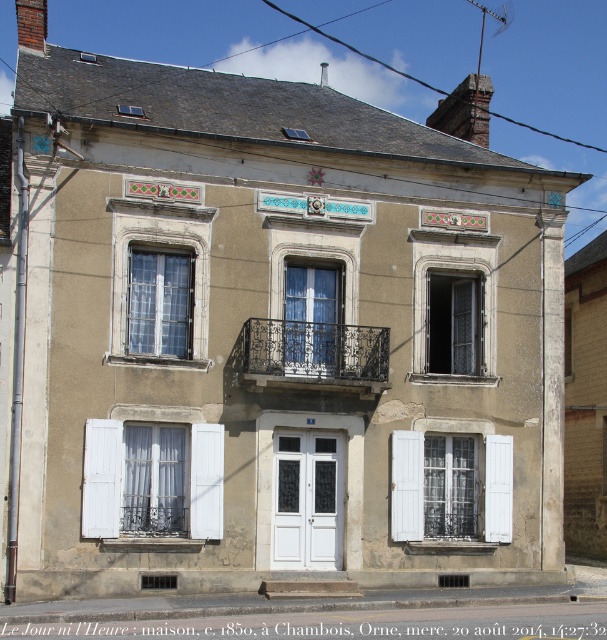
You are a window cleaner with a ladder that can extend up to 3 meters. You need to clean both the white wooden shutter at lower center and the wrought iron balcony at center. Can you reach both with your ladder without moving it?

The white wooden shutter at lower center and wrought iron balcony at center are 3.02 meters apart from each other. Since your ladder can only extend up to 3 meters, you cannot reach both without moving it as the distance exceeds the ladder length.

Looking at this image, you are standing in front of the building and want to place a decorative flag between the two points, point [347,362] and point [330,314]. Which point should the flag be closer to if you want it to appear larger in the image?

The flag should be placed closer to point [347,362] because it is closer to the viewer, making the flag appear larger in the image.